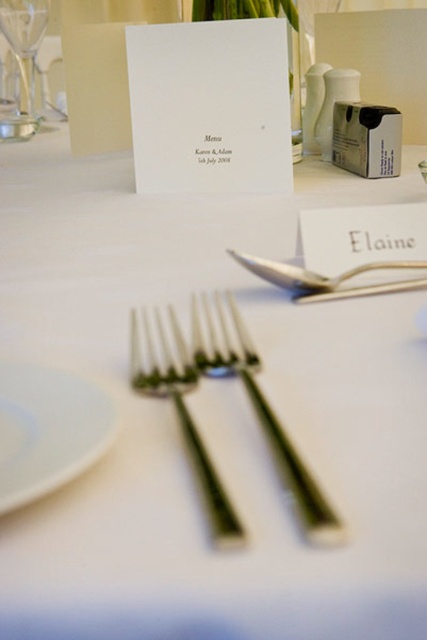
You are a server at a formal event and need to place a napkin between the silver metallic fork at center and the polished silver fork at center. Which fork should you position the napkin closer to to ensure it fits within the space between them?

The silver metallic fork at center is wider than the polished silver fork at center, so positioning the napkin closer to the polished silver fork at center will allow it to fit within the space between them.

You are a guest at a formal dinner and need to place your napkin. The napkin is on the white glossy plate at lower left. You want to move it to the clear glass wine glass at upper left. Can you move it directly without moving any other items?

The white glossy plate at lower left is to the right of the clear glass wine glass at upper left, so you can move the napkin directly from the white glossy plate at lower left to the clear glass wine glass at upper left without moving any other items.

Based on the coordinates provided, which object is located at point [260,412]?

The silver metallic fork at center is located at point [260,412].